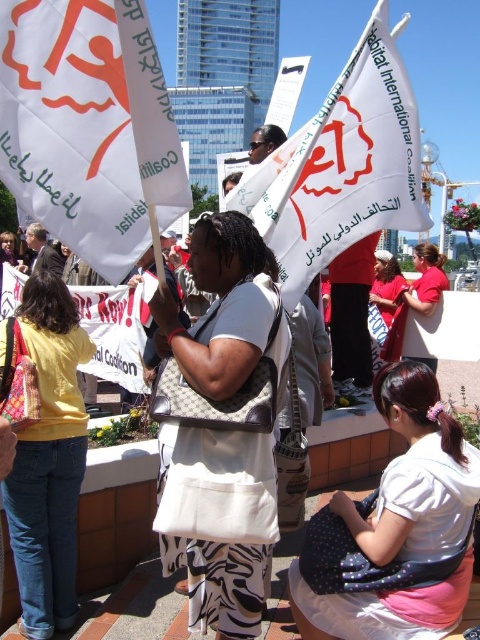
Between white fabric flag at upper center and white fabric flag at center, which one has more height?

Standing taller between the two is white fabric flag at upper center.

The width and height of the screenshot is (480, 640). What do you see at coordinates (88, 125) in the screenshot? I see `white fabric flag at upper center` at bounding box center [88, 125].

Is point (90, 33) positioned behind point (106, 378)?

No, (90, 33) is closer to viewer.

This screenshot has width=480, height=640. I want to click on white fabric flag at upper center, so click(x=88, y=125).

Is white paper flag at upper center in front of white fabric flag at center?

That is True.

Does white paper flag at upper center have a lesser width compared to white fabric flag at center?

In fact, white paper flag at upper center might be wider than white fabric flag at center.

Is point (357, 83) farther from viewer compared to point (84, 310)?

That is False.

At what (x,y) coordinates should I click in order to perform the action: click on white paper flag at upper center. Please return your answer as a coordinate pair (x, y). Looking at the image, I should click on (342, 166).

Does white dotted fabric at lower right appear on the left side of white fabric flag at center?

Incorrect, white dotted fabric at lower right is not on the left side of white fabric flag at center.

Describe the element at coordinates (396, 529) in the screenshot. I see `white dotted fabric at lower right` at that location.

Who is more distant from viewer, (430, 433) or (136, 360)?

Point (136, 360)

Where is `white dotted fabric at lower right`? The image size is (480, 640). white dotted fabric at lower right is located at coordinates click(x=396, y=529).